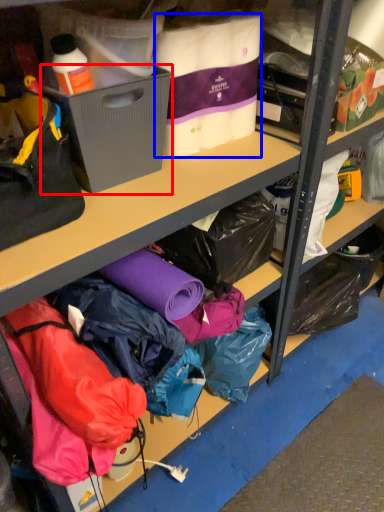
Question: Among these objects, which one is nearest to the camera, box (highlighted by a red box) or clothing (highlighted by a blue box)?

Choices:
 (A) box
 (B) clothing

Answer: (A)